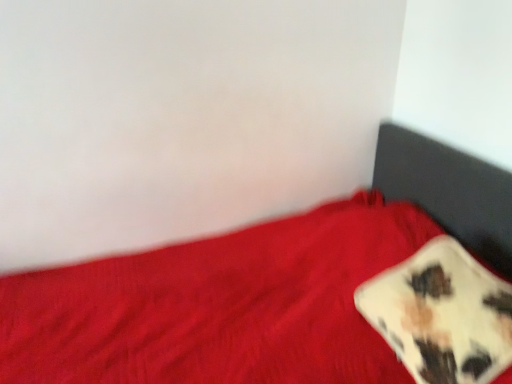
Question: Considering the relative positions of cow print fabric pillow at lower right and red fabric bed at lower right in the image provided, is cow print fabric pillow at lower right to the left of red fabric bed at lower right from the viewer's perspective?

Choices:
 (A) yes
 (B) no

Answer: (B)

Question: Is cow print fabric pillow at lower right smaller than red fabric bed at lower right?

Choices:
 (A) no
 (B) yes

Answer: (B)

Question: Is cow print fabric pillow at lower right positioned in front of red fabric bed at lower right?

Choices:
 (A) yes
 (B) no

Answer: (B)

Question: Is cow print fabric pillow at lower right shorter than red fabric bed at lower right?

Choices:
 (A) no
 (B) yes

Answer: (B)

Question: Is cow print fabric pillow at lower right not near red fabric bed at lower right?

Choices:
 (A) yes
 (B) no

Answer: (B)

Question: From a real-world perspective, is cow print fabric pillow at lower right on top of red fabric bed at lower right?

Choices:
 (A) yes
 (B) no

Answer: (A)

Question: Can you confirm if red fabric bed at lower right is taller than cow print fabric pillow at lower right?

Choices:
 (A) no
 (B) yes

Answer: (B)

Question: Is red fabric bed at lower right positioned before cow print fabric pillow at lower right?

Choices:
 (A) no
 (B) yes

Answer: (B)

Question: Would you say red fabric bed at lower right is a long distance from cow print fabric pillow at lower right?

Choices:
 (A) yes
 (B) no

Answer: (B)

Question: Does red fabric bed at lower right have a smaller size compared to cow print fabric pillow at lower right?

Choices:
 (A) no
 (B) yes

Answer: (A)

Question: Does red fabric bed at lower right have a larger size compared to cow print fabric pillow at lower right?

Choices:
 (A) yes
 (B) no

Answer: (A)

Question: Does red fabric bed at lower right turn towards cow print fabric pillow at lower right?

Choices:
 (A) no
 (B) yes

Answer: (A)

Question: Which is correct: red fabric bed at lower right is inside cow print fabric pillow at lower right, or outside of it?

Choices:
 (A) inside
 (B) outside

Answer: (B)